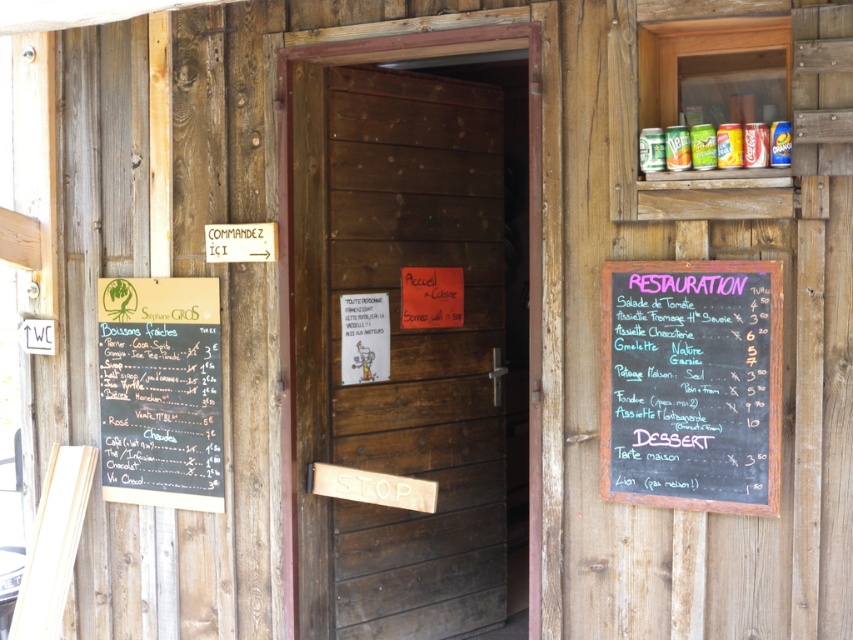
You are standing at the entrance of the rustic wooden building and want to read the prices on the black chalkboard menu at left. Since the dark wood door at center is in the way, can you move closer to get a better view of the menu?

The dark wood door at center is closer to the viewer than the black chalkboard menu at left, so moving closer would bring you nearer to the door but not the menu. You might need to step aside to see the menu clearly.